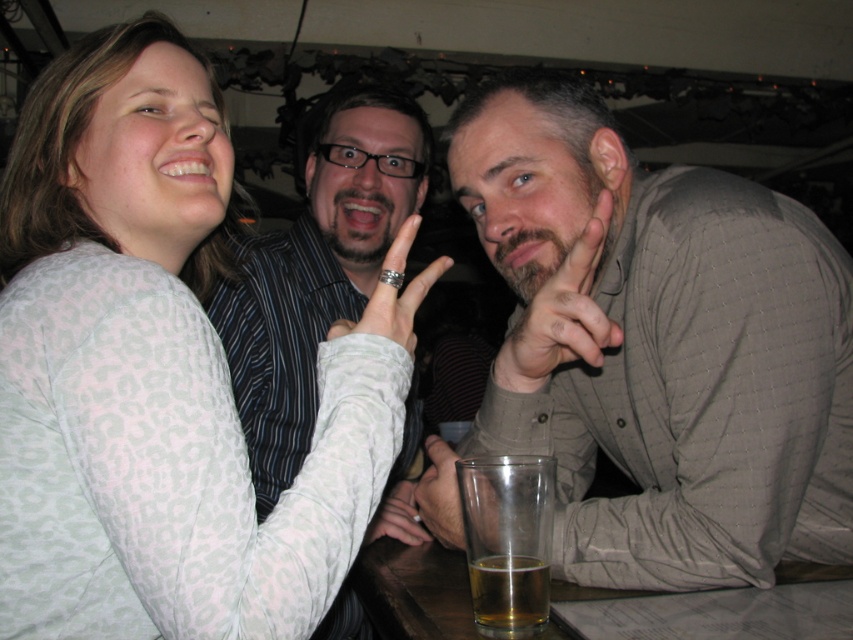
Which of these two, striped shirt at center or golden amber liquid at lower center, stands shorter?

golden amber liquid at lower center is shorter.

Is striped shirt at center to the right of golden amber liquid at lower center from the viewer's perspective?

No, striped shirt at center is not to the right of golden amber liquid at lower center.

Locate an element on the screen. striped shirt at center is located at coordinates [x=317, y=268].

Can you confirm if matte gray shirt at center is taller than striped shirt at center?

In fact, matte gray shirt at center may be shorter than striped shirt at center.

Can you confirm if matte gray shirt at center is shorter than striped shirt at center?

Indeed, matte gray shirt at center has a lesser height compared to striped shirt at center.

Between point (759, 531) and point (310, 372), which one is positioned behind?

The point (310, 372) is behind.

Image resolution: width=853 pixels, height=640 pixels. What are the coordinates of `matte gray shirt at center` in the screenshot? It's located at (659, 346).

Is point (512, 577) closer to viewer compared to point (405, 301)?

Yes, it is in front of point (405, 301).

Describe the element at coordinates (509, 595) in the screenshot. Image resolution: width=853 pixels, height=640 pixels. I see `golden amber liquid at lower center` at that location.

What do you see at coordinates (509, 595) in the screenshot? The width and height of the screenshot is (853, 640). I see `golden amber liquid at lower center` at bounding box center [509, 595].

In order to click on golden amber liquid at lower center in this screenshot , I will do `click(509, 595)`.